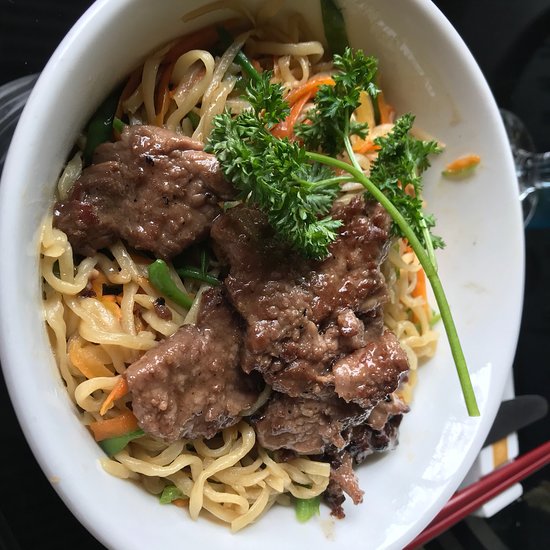
Identify the location of chopsticks. Image resolution: width=550 pixels, height=550 pixels. (489, 482), (490, 494).